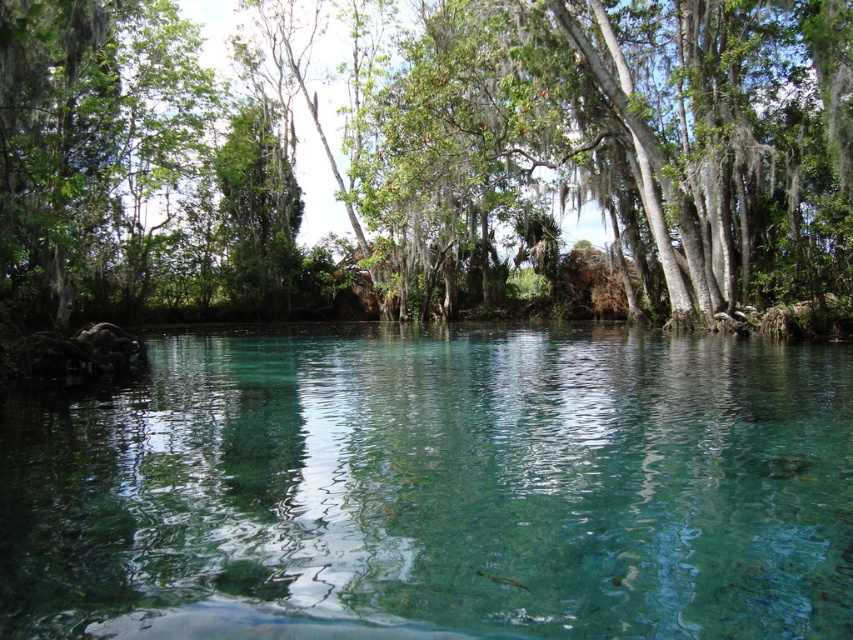
Is clear glass river at center wider than green leafy tree at center?

Incorrect, clear glass river at center's width does not surpass green leafy tree at center's.

Does clear glass river at center have a larger size compared to green leafy tree at center?

No, clear glass river at center is not bigger than green leafy tree at center.

Is point (822, 620) positioned after point (30, 307)?

That is False.

In order to click on clear glass river at center in this screenshot , I will do `click(436, 488)`.